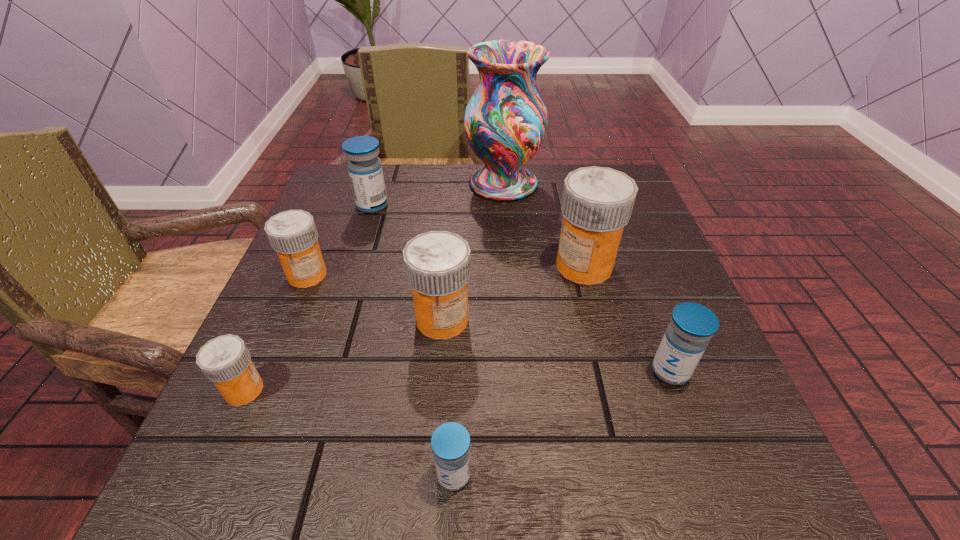
Point out which blue medicine is positioned as the third nearest to the seventh shortest object. Please provide its 2D coordinates. Your answer should be formatted as a tuple, i.e. [(x, y)], where the tuple contains the x and y coordinates of a point satisfying the conditions above.

[(365, 170)]

What are the coordinates of `vacant space that satisfies the following two spatial constraints: 1. on the label side of the fourth farthest medicine; 2. on the right side of the second smallest blue medicine` in the screenshot? It's located at (438, 371).

Where is `free spot that satisfies the following two spatial constraints: 1. on the label side of the fourth nearest object; 2. on the label side of the nearest orange medicine`? free spot that satisfies the following two spatial constraints: 1. on the label side of the fourth nearest object; 2. on the label side of the nearest orange medicine is located at coordinates (437, 390).

I want to click on free point that satisfies the following two spatial constraints: 1. on the front side of the farthest blue medicine; 2. on the right side of the nearest medicine, so tap(287, 475).

At what (x,y) coordinates should I click in order to perform the action: click on free space that satisfies the following two spatial constraints: 1. on the label side of the fourth nearest object; 2. on the label side of the smallest orange medicine. Please return your answer as a coordinate pair (x, y). This screenshot has height=540, width=960. Looking at the image, I should click on (437, 390).

Where is `blank area in the image that satisfies the following two spatial constraints: 1. on the label side of the seventh shortest object; 2. on the label side of the third smallest orange medicine`? The width and height of the screenshot is (960, 540). blank area in the image that satisfies the following two spatial constraints: 1. on the label side of the seventh shortest object; 2. on the label side of the third smallest orange medicine is located at coordinates (598, 319).

At what (x,y) coordinates should I click in order to perform the action: click on free space in the image that satisfies the following two spatial constraints: 1. on the label side of the rightmost medicine; 2. on the left side of the third smallest orange medicine. Please return your answer as a coordinate pair (x, y). The image size is (960, 540). Looking at the image, I should click on (438, 371).

Identify the location of free region that satisfies the following two spatial constraints: 1. on the front side of the rightmost blue medicine; 2. on the right side of the vase. The image size is (960, 540). (517, 371).

At what (x,y) coordinates should I click in order to perform the action: click on free space that satisfies the following two spatial constraints: 1. on the label side of the third biggest orange medicine; 2. on the label side of the smallest orange medicine. Please return your answer as a coordinate pair (x, y). This screenshot has width=960, height=540. Looking at the image, I should click on (258, 390).